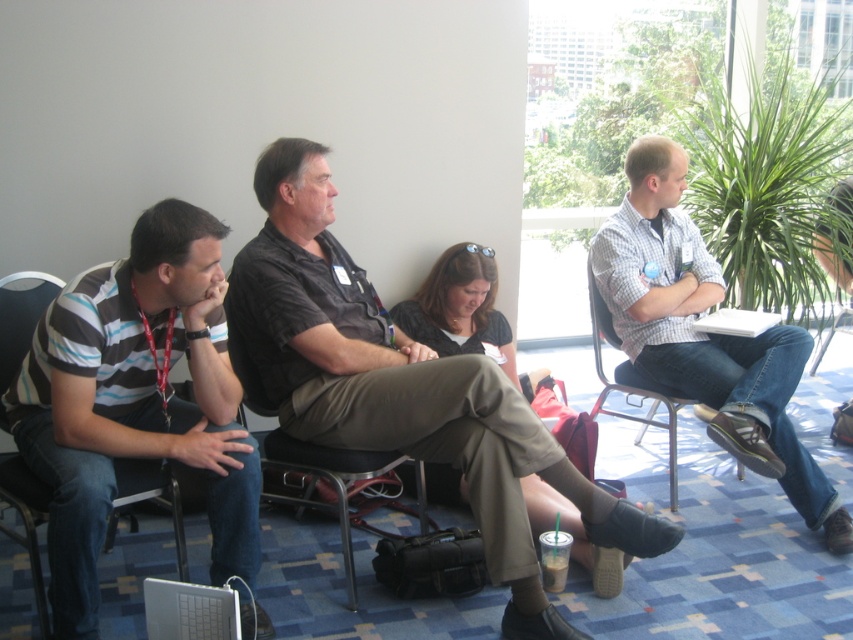
You are organizing a presentation and need to know the placement of the laptops. According to the scene, which laptop is positioned lower between the silver metallic laptop at lower left and the white matte laptop at right?

The silver metallic laptop at lower left is positioned lower than the white matte laptop at right.

You are standing in the conference room and want to locate the point at coordinates (x=401, y=387). According to the scene description, where is this point located?

The point at coordinates (x=401, y=387) is located on the dark brown shirt at center.